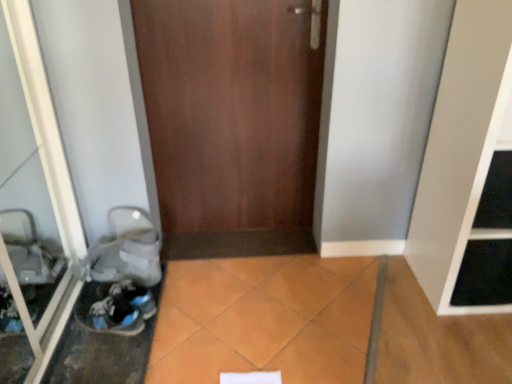
Question: From a real-world perspective, is white matte shelf at right under transparent glass door at left?

Choices:
 (A) no
 (B) yes

Answer: (B)

Question: From the image's perspective, is white matte shelf at right on top of transparent glass door at left?

Choices:
 (A) yes
 (B) no

Answer: (A)

Question: Is white matte shelf at right smaller than transparent glass door at left?

Choices:
 (A) yes
 (B) no

Answer: (B)

Question: Considering the relative sizes of white matte shelf at right and transparent glass door at left in the image provided, is white matte shelf at right taller than transparent glass door at left?

Choices:
 (A) no
 (B) yes

Answer: (B)

Question: Is transparent glass door at left surrounded by white matte shelf at right?

Choices:
 (A) no
 (B) yes

Answer: (A)

Question: From a real-world perspective, is blue suede sneakers at lower left positioned above or below transparent glass door at left?

Choices:
 (A) above
 (B) below

Answer: (B)

Question: Is blue suede sneakers at lower left to the left or to the right of transparent glass door at left in the image?

Choices:
 (A) left
 (B) right

Answer: (B)

Question: Choose the correct answer: Is blue suede sneakers at lower left inside transparent glass door at left or outside it?

Choices:
 (A) outside
 (B) inside

Answer: (A)

Question: Considering the positions of point (100, 312) and point (27, 139), is point (100, 312) closer or farther from the camera than point (27, 139)?

Choices:
 (A) closer
 (B) farther

Answer: (A)

Question: From a real-world perspective, is wooden door at center physically located above or below blue suede sneakers at lower left?

Choices:
 (A) below
 (B) above

Answer: (B)

Question: Is wooden door at center in front of or behind blue suede sneakers at lower left in the image?

Choices:
 (A) behind
 (B) front

Answer: (A)

Question: Considering the positions of wooden door at center and blue suede sneakers at lower left in the image, is wooden door at center taller or shorter than blue suede sneakers at lower left?

Choices:
 (A) short
 (B) tall

Answer: (B)

Question: In terms of width, does wooden door at center look wider or thinner when compared to blue suede sneakers at lower left?

Choices:
 (A) thin
 (B) wide

Answer: (A)

Question: Do you think blue suede sneakers at lower left is within white matte shelf at right, or outside of it?

Choices:
 (A) inside
 (B) outside

Answer: (B)

Question: In the image, is blue suede sneakers at lower left positioned in front of or behind white matte shelf at right?

Choices:
 (A) behind
 (B) front

Answer: (A)